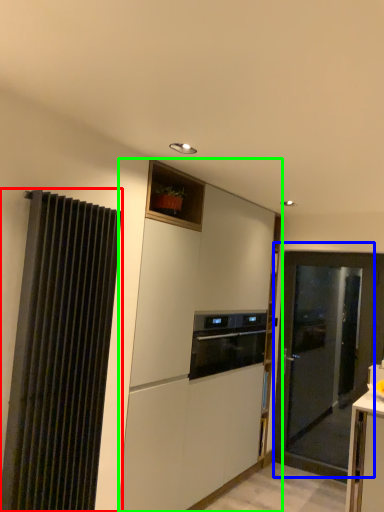
Question: Which is farther away from curtain (highlighted by a red box)? door (highlighted by a blue box) or cabinetry (highlighted by a green box)?

Choices:
 (A) door
 (B) cabinetry

Answer: (A)